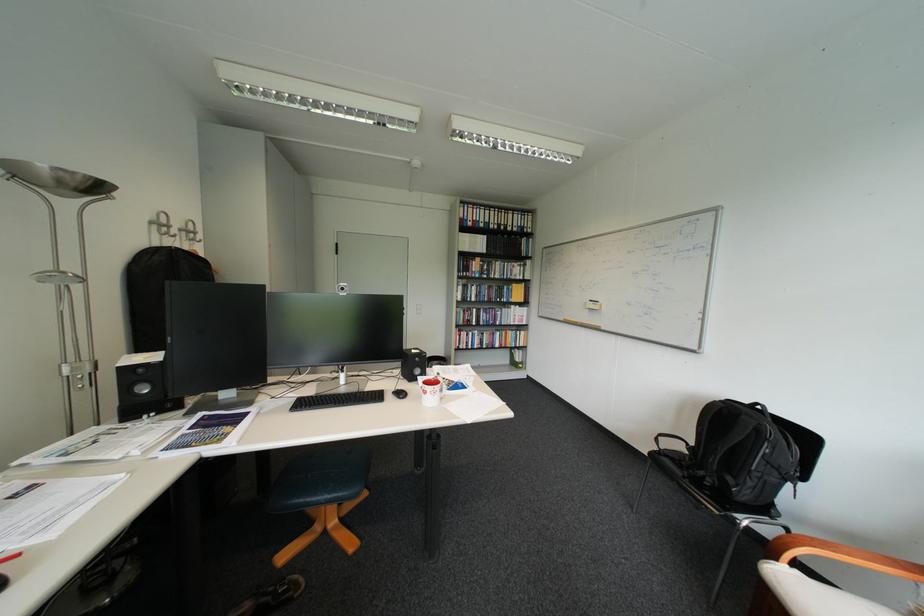
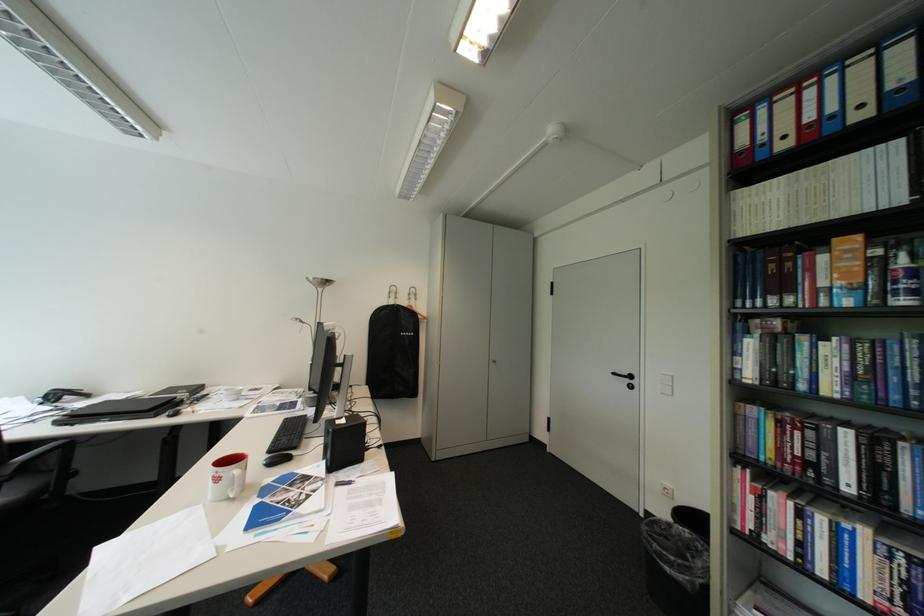
Where in the second image is the point corresponding to the point at 489,257 from the first image?

(848, 240)